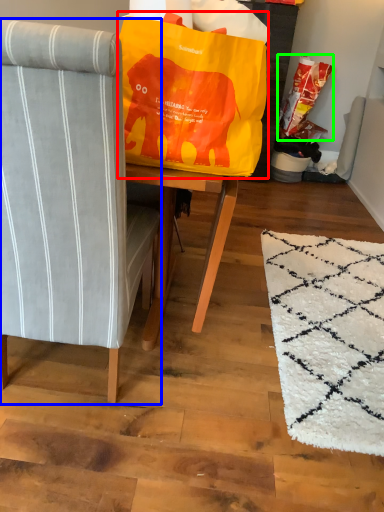
Question: Which object is the closest to the bean bag chair (highlighted by a red box)? Choose among these: chair (highlighted by a blue box) or grocery bag (highlighted by a green box).

Choices:
 (A) chair
 (B) grocery bag

Answer: (A)